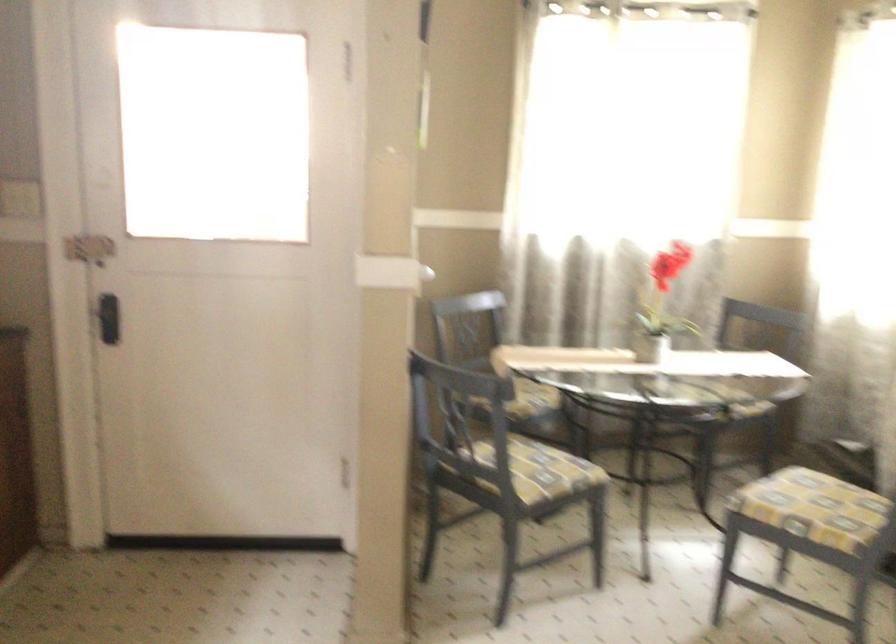
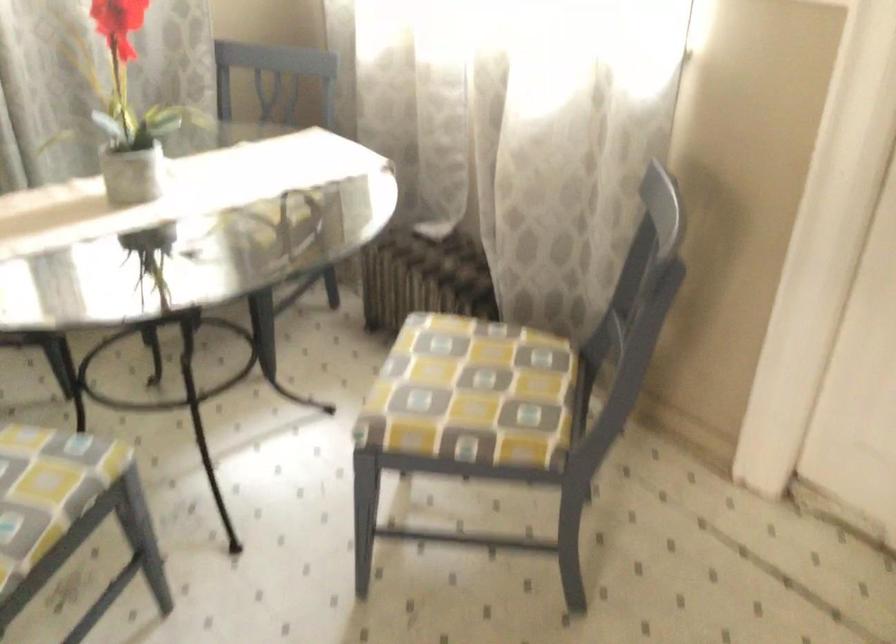
Locate, in the second image, the point that corresponds to (788,471) in the first image.

(467, 379)